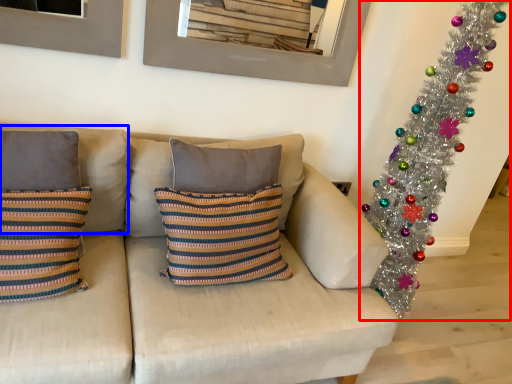
Question: Which object is closer to the camera taking this photo, christmas tree (highlighted by a red box) or pillow (highlighted by a blue box)?

Choices:
 (A) christmas tree
 (B) pillow

Answer: (B)